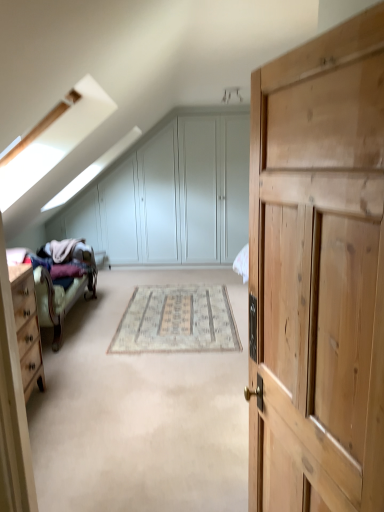
The width and height of the screenshot is (384, 512). What do you see at coordinates (177, 321) in the screenshot?
I see `beige woven rug at center` at bounding box center [177, 321].

The image size is (384, 512). I want to click on wooden bed frame at left, so click(x=64, y=289).

This screenshot has height=512, width=384. Find the location of `natural wood cupboard at right`. natural wood cupboard at right is located at coordinates (318, 273).

In order to click on beige woven rug at center in this screenshot , I will do `click(177, 321)`.

Is natural wood cupboard at right in front of beige woven rug at center?

That is True.

Between point (295, 195) and point (137, 294), which one is positioned behind?

The point (137, 294) is behind.

From the image's perspective, which object appears higher, natural wood cupboard at right or beige woven rug at center?

From the image's view, natural wood cupboard at right is above.

How many degrees apart are the facing directions of natural wood cupboard at right and beige woven rug at center?

76.5 degrees.

Considering the sizes of objects natural wood cupboard at right and light wood dresser at left in the image provided, who is bigger, natural wood cupboard at right or light wood dresser at left?

light wood dresser at left.

Who is shorter, natural wood cupboard at right or light wood dresser at left?

light wood dresser at left is shorter.

Are natural wood cupboard at right and light wood dresser at left beside each other?

natural wood cupboard at right is not next to light wood dresser at left, and they're not touching.

Considering the positions of objects natural wood cupboard at right and light wood dresser at left in the image provided, who is behind, natural wood cupboard at right or light wood dresser at left?

light wood dresser at left is further from the camera.

Choose the correct answer: Is velvet purple blanket at left inside wooden bed frame at left or outside it?

velvet purple blanket at left is contained in wooden bed frame at left.

Is velvet purple blanket at left far from wooden bed frame at left?

No.

How far apart are velvet purple blanket at left and wooden bed frame at left?

velvet purple blanket at left and wooden bed frame at left are 3.45 inches apart from each other.

From a real-world perspective, which object stands above the other?

From a 3D spatial view, velvet purple blanket at left is above.

Considering the relative sizes of light wood dresser at left and natural wood cupboard at right in the image provided, is light wood dresser at left bigger than natural wood cupboard at right?

Yes, light wood dresser at left is bigger than natural wood cupboard at right.

Considering the sizes of objects light wood dresser at left and natural wood cupboard at right in the image provided, who is thinner, light wood dresser at left or natural wood cupboard at right?

natural wood cupboard at right is thinner.

Considering the positions of objects light wood dresser at left and natural wood cupboard at right in the image provided, who is behind, light wood dresser at left or natural wood cupboard at right?

light wood dresser at left is further away from the camera.

Could you tell me if light wood dresser at left is turned towards natural wood cupboard at right?

No.

Does beige woven rug at center touch wooden bed frame at left?

beige woven rug at center is not next to wooden bed frame at left, and they're not touching.

From the image's perspective, is beige woven rug at center on top of wooden bed frame at left?

No.

Is beige woven rug at center taller than wooden bed frame at left?

Incorrect, the height of beige woven rug at center is not larger of that of wooden bed frame at left.

Considering the relative sizes of light wood dresser at left and beige woven rug at center in the image provided, is light wood dresser at left thinner than beige woven rug at center?

Yes, light wood dresser at left is thinner than beige woven rug at center.

Is light wood dresser at left positioned far away from beige woven rug at center?

Yes.

Measure the distance between light wood dresser at left and beige woven rug at center.

light wood dresser at left and beige woven rug at center are 3.72 feet apart from each other.

From the picture: Considering the sizes of objects light wood dresser at left and beige woven rug at center in the image provided, who is bigger, light wood dresser at left or beige woven rug at center?

light wood dresser at left is bigger.

In terms of height, does wooden bed frame at left look taller or shorter compared to velvet purple blanket at left?

Clearly, wooden bed frame at left is taller compared to velvet purple blanket at left.

Which point is more distant from viewer, (43, 269) or (39, 253)?

The point (39, 253) is behind.

Is wooden bed frame at left at the left side of velvet purple blanket at left?

Yes.

From a real-world perspective, is wooden bed frame at left positioned under velvet purple blanket at left based on gravity?

Correct, in the physical world, wooden bed frame at left is lower than velvet purple blanket at left.

This screenshot has width=384, height=512. In order to click on mat below the natural wood cupboard at right (from the image's perspective) in this screenshot , I will do `click(177, 321)`.

The height and width of the screenshot is (512, 384). What are the coordinates of `cupboard that is above the light wood dresser at left (from a real-world perspective)` in the screenshot? It's located at (318, 273).

From the image, which object appears to be farther from white matte dresser at upper center, wooden bed frame at left or beige woven rug at center?

Among the two, beige woven rug at center is located further to white matte dresser at upper center.

Looking at the image, which one is located closer to wooden bed frame at left, natural wood cupboard at right or white matte dresser at upper center?

white matte dresser at upper center lies closer to wooden bed frame at left than the other object.

Considering their positions, is wooden bed frame at left positioned further to light wood dresser at left than white matte dresser at upper center?

The object further to light wood dresser at left is white matte dresser at upper center.

Estimate the real-world distances between objects in this image. Which object is further from velvet purple blanket at left, natural wood cupboard at right or light wood dresser at left?

natural wood cupboard at right is further to velvet purple blanket at left.

Considering their positions, is velvet purple blanket at left positioned further to white matte dresser at upper center than natural wood cupboard at right?

natural wood cupboard at right lies further to white matte dresser at upper center than the other object.

Estimate the real-world distances between objects in this image. Which object is further from wooden bed frame at left, beige woven rug at center or velvet purple blanket at left?

Based on the image, beige woven rug at center appears to be further to wooden bed frame at left.

From the image, which object appears to be nearer to wooden bed frame at left, light wood dresser at left or beige woven rug at center?

Based on the image, light wood dresser at left appears to be nearer to wooden bed frame at left.

Looking at the image, which one is located closer to natural wood cupboard at right, white matte dresser at upper center or wooden bed frame at left?

Based on the image, wooden bed frame at left appears to be nearer to natural wood cupboard at right.

Find the location of a particular element. This screenshot has width=384, height=512. chest of drawers between natural wood cupboard at right and wooden bed frame at left from front to back is located at coordinates (27, 327).

Identify the location of bed frame positioned between natural wood cupboard at right and velvet purple blanket at left from near to far. This screenshot has width=384, height=512. (64, 289).

Identify the location of bedding located between light wood dresser at left and white matte dresser at upper center in the depth direction. This screenshot has height=512, width=384. (65, 263).

This screenshot has width=384, height=512. I want to click on chest of drawers between natural wood cupboard at right and velvet purple blanket at left in the front-back direction, so click(x=27, y=327).